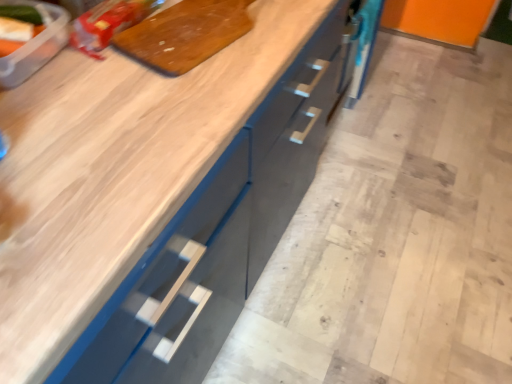
This screenshot has height=384, width=512. I want to click on translucent plastic container at upper left, which is counted as the first food, starting from the front, so click(20, 25).

I want to click on matte plastic bag at upper left, the 1th food viewed from the right, so click(108, 23).

What is the approximate height of wooden cutting board at upper center?

It is 0.84 inches.

Where is `translucent plastic container at upper left, placed as the second food when sorted from right to left`? This screenshot has height=384, width=512. translucent plastic container at upper left, placed as the second food when sorted from right to left is located at coordinates (20, 25).

Between matte plastic bag at upper left, the second food from the left, and translucent plastic container at upper left, arranged as the 1th food when viewed from the left, which one appears on the left side from the viewer's perspective?

Positioned to the left is translucent plastic container at upper left, arranged as the 1th food when viewed from the left.

Is matte plastic bag at upper left, the first food viewed from the back, facing away from translucent plastic container at upper left, which is the 2th food from back to front?

No.

Is matte plastic bag at upper left, the first food viewed from the back, bigger than translucent plastic container at upper left, which is the 2th food from back to front?

Yes, matte plastic bag at upper left, the first food viewed from the back, is bigger than translucent plastic container at upper left, which is the 2th food from back to front.

From a real-world perspective, between matte plastic bag at upper left, which is the second food from front to back, and translucent plastic container at upper left, placed as the second food when sorted from right to left, who is vertically higher?

translucent plastic container at upper left, placed as the second food when sorted from right to left, is physically above.

How many degrees apart are the facing directions of translucent plastic container at upper left, which is the 2th food from back to front, and wooden cutting board at upper center?

17.3 degrees.

Which is correct: translucent plastic container at upper left, placed as the second food when sorted from right to left, is inside wooden cutting board at upper center, or outside of it?

translucent plastic container at upper left, placed as the second food when sorted from right to left, is outside wooden cutting board at upper center.

Between point (36, 10) and point (158, 16), which one is positioned behind?

Positioned behind is point (158, 16).

Which object is positioned more to the right, wooden cutting board at upper center or matte plastic bag at upper left, the second food from the left?

wooden cutting board at upper center is more to the right.

Based on the photo, are wooden cutting board at upper center and matte plastic bag at upper left, the first food viewed from the back, located far from each other?

No, wooden cutting board at upper center is not far away from matte plastic bag at upper left, the first food viewed from the back.

Based on the photo, considering the sizes of objects wooden cutting board at upper center and matte plastic bag at upper left, the 1th food viewed from the right, in the image provided, who is thinner, wooden cutting board at upper center or matte plastic bag at upper left, the 1th food viewed from the right,?

With smaller width is matte plastic bag at upper left, the 1th food viewed from the right.

Based on the photo, could you measure the distance between wooden cutting board at upper center and matte plastic bag at upper left, the first food viewed from the back?

The distance of wooden cutting board at upper center from matte plastic bag at upper left, the first food viewed from the back, is 3.74 inches.

Which is more to the right, wooden cutting board at upper center or translucent plastic container at upper left, placed as the second food when sorted from right to left?

Positioned to the right is wooden cutting board at upper center.

Does wooden cutting board at upper center have a lesser height compared to translucent plastic container at upper left, which is the 2th food from back to front?

Correct, wooden cutting board at upper center is not as tall as translucent plastic container at upper left, which is the 2th food from back to front.

Is wooden cutting board at upper center directly adjacent to translucent plastic container at upper left, placed as the second food when sorted from right to left?

No, wooden cutting board at upper center is not next to translucent plastic container at upper left, placed as the second food when sorted from right to left.

The height and width of the screenshot is (384, 512). Identify the location of cutting board in front of the matte plastic bag at upper left, the second food from the left. (184, 34).

From the image's perspective, which object appears higher, matte plastic bag at upper left, the second food from the left, or wooden cutting board at upper center?

matte plastic bag at upper left, the second food from the left, appears higher in the image.

Which of these two, matte plastic bag at upper left, the 1th food viewed from the right, or wooden cutting board at upper center, stands shorter?

Standing shorter between the two is wooden cutting board at upper center.

Is translucent plastic container at upper left, arranged as the 1th food when viewed from the left, bigger than matte plastic bag at upper left, the second food from the left?

No, translucent plastic container at upper left, arranged as the 1th food when viewed from the left, is not bigger than matte plastic bag at upper left, the second food from the left.

Could you measure the distance between translucent plastic container at upper left, which is the 2th food from back to front, and matte plastic bag at upper left, the first food viewed from the back?

translucent plastic container at upper left, which is the 2th food from back to front, and matte plastic bag at upper left, the first food viewed from the back, are 4.49 inches apart from each other.

Is translucent plastic container at upper left, placed as the second food when sorted from right to left, thinner than matte plastic bag at upper left, the first food viewed from the back?

Answer: Indeed, translucent plastic container at upper left, placed as the second food when sorted from right to left, has a lesser width compared to matte plastic bag at upper left, the first food viewed from the back.

In the image, there is a translucent plastic container at upper left, which is the 2th food from back to front. Where is `food below it (from a real-world perspective)`? The image size is (512, 384). food below it (from a real-world perspective) is located at coordinates (108, 23).

The image size is (512, 384). In order to click on food above the translucent plastic container at upper left, placed as the second food when sorted from right to left (from the image's perspective) in this screenshot , I will do `click(108, 23)`.

The width and height of the screenshot is (512, 384). I want to click on cutting board to the right of translucent plastic container at upper left, which is the 2th food from back to front, so (x=184, y=34).

Estimate the real-world distances between objects in this image. Which object is closer to matte plastic bag at upper left, which is the second food from front to back, translucent plastic container at upper left, arranged as the 1th food when viewed from the left, or wooden cutting board at upper center?

wooden cutting board at upper center is closer to matte plastic bag at upper left, which is the second food from front to back.

Which object lies nearer to the anchor point translucent plastic container at upper left, placed as the second food when sorted from right to left, wooden cutting board at upper center or matte plastic bag at upper left, the second food from the left?

matte plastic bag at upper left, the second food from the left, lies closer to translucent plastic container at upper left, placed as the second food when sorted from right to left, than the other object.

Which object lies nearer to the anchor point translucent plastic container at upper left, arranged as the 1th food when viewed from the left, matte plastic bag at upper left, which is the second food from front to back, or wooden cutting board at upper center?

matte plastic bag at upper left, which is the second food from front to back, lies closer to translucent plastic container at upper left, arranged as the 1th food when viewed from the left, than the other object.

Considering their positions, is wooden cutting board at upper center positioned closer to matte plastic bag at upper left, the first food viewed from the back, than translucent plastic container at upper left, which is the 2th food from back to front?

wooden cutting board at upper center lies closer to matte plastic bag at upper left, the first food viewed from the back, than the other object.

Estimate the real-world distances between objects in this image. Which object is closer to wooden cutting board at upper center, translucent plastic container at upper left, which is counted as the first food, starting from the front, or matte plastic bag at upper left, the first food viewed from the back?

matte plastic bag at upper left, the first food viewed from the back.

From the image, which object appears to be farther from wooden cutting board at upper center, matte plastic bag at upper left, the 1th food viewed from the right, or translucent plastic container at upper left, arranged as the 1th food when viewed from the left?

translucent plastic container at upper left, arranged as the 1th food when viewed from the left, lies further to wooden cutting board at upper center than the other object.

Locate an element on the screen. The image size is (512, 384). food between translucent plastic container at upper left, placed as the second food when sorted from right to left, and wooden cutting board at upper center from left to right is located at coordinates (108, 23).